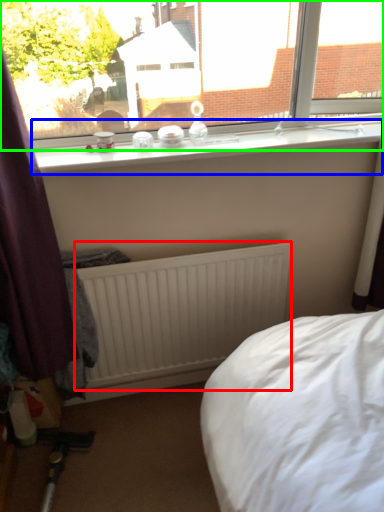
Question: Which is nearer to the radiator (highlighted by a red box)? window sill (highlighted by a blue box) or window (highlighted by a green box).

Choices:
 (A) window sill
 (B) window

Answer: (A)